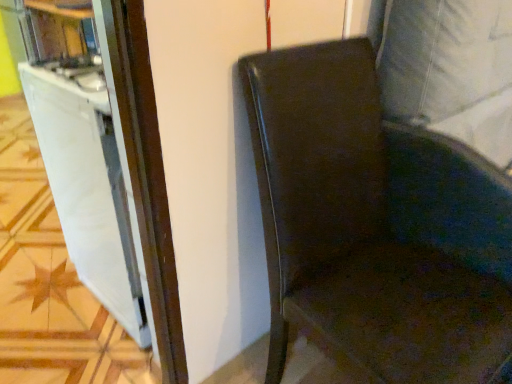
This screenshot has width=512, height=384. What do you see at coordinates (376, 224) in the screenshot? I see `glossy leather chair at right` at bounding box center [376, 224].

Identify the location of glossy leather chair at right. The width and height of the screenshot is (512, 384). (376, 224).

What is the approximate height of white glossy file cabinet at left?

The height of white glossy file cabinet at left is 34.71 inches.

The image size is (512, 384). Find the location of `white glossy file cabinet at left`. white glossy file cabinet at left is located at coordinates (88, 188).

What do you see at coordinates (88, 188) in the screenshot?
I see `white glossy file cabinet at left` at bounding box center [88, 188].

Find the location of a particular element. glossy leather chair at right is located at coordinates (376, 224).

Does white glossy file cabinet at left appear on the right side of glossy leather chair at right?

No.

Relative to glossy leather chair at right, is white glossy file cabinet at left in front or behind?

white glossy file cabinet at left is behind glossy leather chair at right.

Which is farther, (96, 294) or (511, 181)?

Point (96, 294)

From the image's perspective, is white glossy file cabinet at left positioned above or below glossy leather chair at right?

Clearly, from the image's perspective, white glossy file cabinet at left is above glossy leather chair at right.

From a real-world perspective, is white glossy file cabinet at left physically above glossy leather chair at right?

Incorrect, from a real-world perspective, white glossy file cabinet at left is lower than glossy leather chair at right.

In terms of width, does white glossy file cabinet at left look wider or thinner when compared to glossy leather chair at right?

white glossy file cabinet at left is thinner than glossy leather chair at right.

Between white glossy file cabinet at left and glossy leather chair at right, which one has more height?

glossy leather chair at right is taller.

Considering the relative sizes of white glossy file cabinet at left and glossy leather chair at right in the image provided, is white glossy file cabinet at left bigger than glossy leather chair at right?

Actually, white glossy file cabinet at left might be smaller than glossy leather chair at right.

Is white glossy file cabinet at left surrounding glossy leather chair at right?

No.

Is white glossy file cabinet at left positioned far away from glossy leather chair at right?

white glossy file cabinet at left is near glossy leather chair at right, not far away.

Could you tell me if white glossy file cabinet at left is turned towards glossy leather chair at right?

No, white glossy file cabinet at left does not turn towards glossy leather chair at right.

What's the angular difference between white glossy file cabinet at left and glossy leather chair at right's facing directions?

white glossy file cabinet at left and glossy leather chair at right are facing 176 degrees away from each other.

The height and width of the screenshot is (384, 512). What are the coordinates of `chair on the right of white glossy file cabinet at left` in the screenshot? It's located at (376, 224).

Is glossy leather chair at right at the left side of white glossy file cabinet at left?

No.

Which object is further away from the camera taking this photo, glossy leather chair at right or white glossy file cabinet at left?

white glossy file cabinet at left.

Which point is more forward, (294, 87) or (92, 158)?

Positioned in front is point (294, 87).

From the image's perspective, is glossy leather chair at right located above white glossy file cabinet at left?

No, from the image's perspective, glossy leather chair at right is not over white glossy file cabinet at left.

From a real-world perspective, is glossy leather chair at right located beneath white glossy file cabinet at left?

No, from a real-world perspective, glossy leather chair at right is not under white glossy file cabinet at left.

In terms of width, does glossy leather chair at right look wider or thinner when compared to white glossy file cabinet at left?

Clearly, glossy leather chair at right has more width compared to white glossy file cabinet at left.

Does glossy leather chair at right have a lesser height compared to white glossy file cabinet at left?

No.

Based on their sizes in the image, would you say glossy leather chair at right is bigger or smaller than white glossy file cabinet at left?

Clearly, glossy leather chair at right is larger in size than white glossy file cabinet at left.

Is glossy leather chair at right outside of white glossy file cabinet at left?

Absolutely, glossy leather chair at right is external to white glossy file cabinet at left.

Is glossy leather chair at right in contact with white glossy file cabinet at left?

No, glossy leather chair at right is not touching white glossy file cabinet at left.

Could you tell me if glossy leather chair at right is turned towards white glossy file cabinet at left?

No.

Identify the location of file cabinet to the left of glossy leather chair at right. (88, 188).

Where is `chair on the right of white glossy file cabinet at left`? chair on the right of white glossy file cabinet at left is located at coordinates (376, 224).

The height and width of the screenshot is (384, 512). Identify the location of file cabinet beneath the glossy leather chair at right (from a real-world perspective). (88, 188).